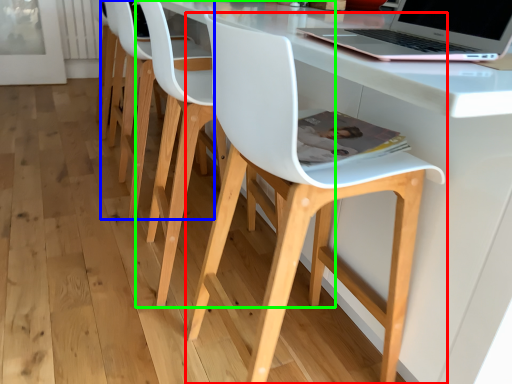
Question: Which is farther away from chair (highlighted by a red box)? chair (highlighted by a blue box) or chair (highlighted by a green box)?

Choices:
 (A) chair
 (B) chair

Answer: (A)